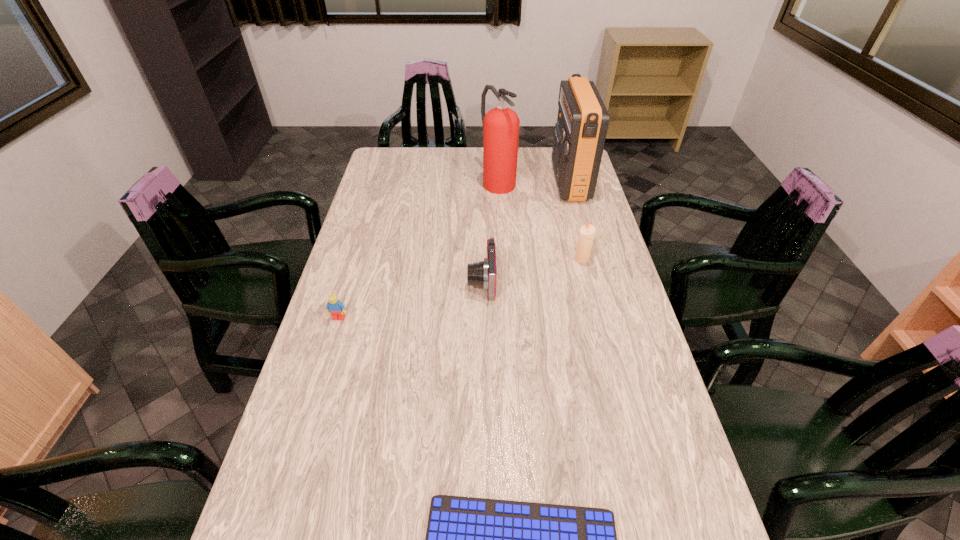
Locate an element on the screen. This screenshot has height=540, width=960. fire extinguisher is located at coordinates (501, 124).

This screenshot has height=540, width=960. In order to click on radio receiver in this screenshot , I will do click(x=580, y=132).

You are a GUI agent. You are given a task and a screenshot of the screen. Output one action in this format:
    pyautogui.click(x=<x>, y=<y>)
    Task: Click on the fourth shortest object
    This screenshot has height=540, width=960.
    Given the screenshot: What is the action you would take?
    pyautogui.click(x=587, y=232)

Where is `camera`? Image resolution: width=960 pixels, height=540 pixels. camera is located at coordinates (482, 274).

Image resolution: width=960 pixels, height=540 pixels. Identify the location of Lego. (336, 308).

Identify the location of the fifth farthest object. This screenshot has width=960, height=540. coord(336,308).

In order to click on vacant space positioned 0.340m on the handle side of the fire extinguisher in this screenshot , I will do 502,254.

I want to click on free location located on the front-facing side of the radio receiver, so click(x=468, y=181).

You are a GUI agent. You are given a task and a screenshot of the screen. Output one action in this format:
    pyautogui.click(x=<x>, y=<y>)
    Task: Click on the vacant area situated on the front-facing side of the radio receiver
    
    Given the screenshot: What is the action you would take?
    pyautogui.click(x=515, y=181)

Identify the location of free spot located on the front-facing side of the radio receiver. (500, 181).